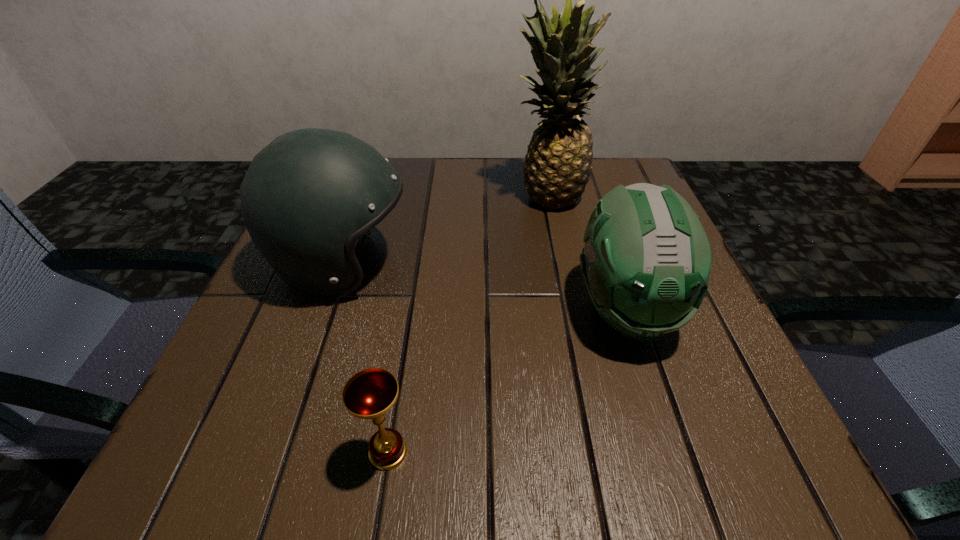
The image size is (960, 540). Find the location of `free space at the left edge of the desktop`. free space at the left edge of the desktop is located at coordinates (298, 397).

I want to click on free spot at the near left corner of the desktop, so click(x=195, y=457).

Locate an element on the screen. This screenshot has height=540, width=960. free space at the near right corner of the desktop is located at coordinates (724, 464).

This screenshot has height=540, width=960. What are the coordinates of `free spot between the nearest object and the third shortest object` in the screenshot? It's located at (365, 358).

The image size is (960, 540). What are the coordinates of `unoccupied area between the third shortest object and the shortest object` in the screenshot? It's located at (365, 358).

What are the coordinates of `empty location between the nearest object and the shorter football helmet` in the screenshot? It's located at (507, 381).

Where is `vacant region between the farthest object and the nearest object`? vacant region between the farthest object and the nearest object is located at coordinates (468, 324).

Find the location of a particular element. The image size is (960, 540). free space between the pineapple and the second tallest object is located at coordinates (445, 230).

Where is `free space between the nearest object and the tallest object`? free space between the nearest object and the tallest object is located at coordinates (468, 324).

The image size is (960, 540). In order to click on free space between the third tallest object and the shortest object in this screenshot , I will do `click(507, 381)`.